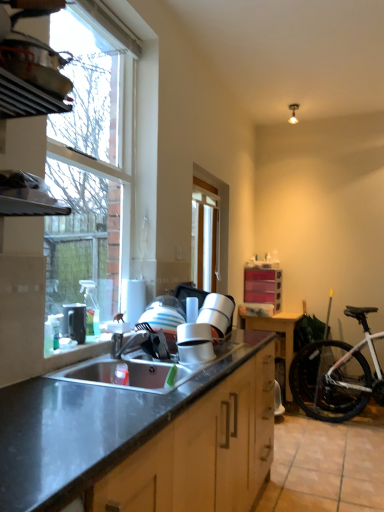
You are a GUI agent. You are given a task and a screenshot of the screen. Output one action in this format:
    pyautogui.click(x=<x>, y=<y>)
    Task: Click on the unoccupied area in front of white matte bicycle at lower right
    The width and height of the screenshot is (384, 512).
    Given the screenshot: What is the action you would take?
    pyautogui.click(x=339, y=442)